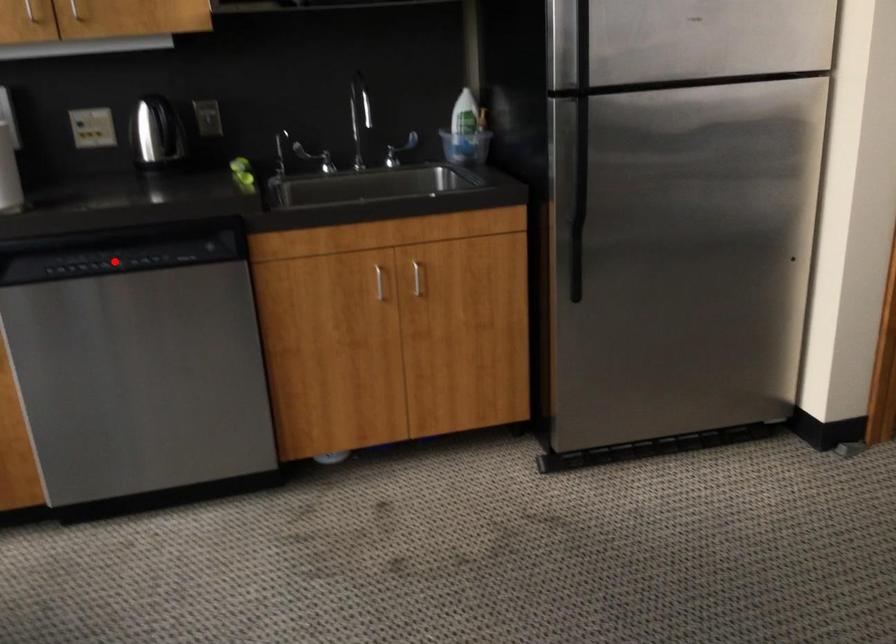
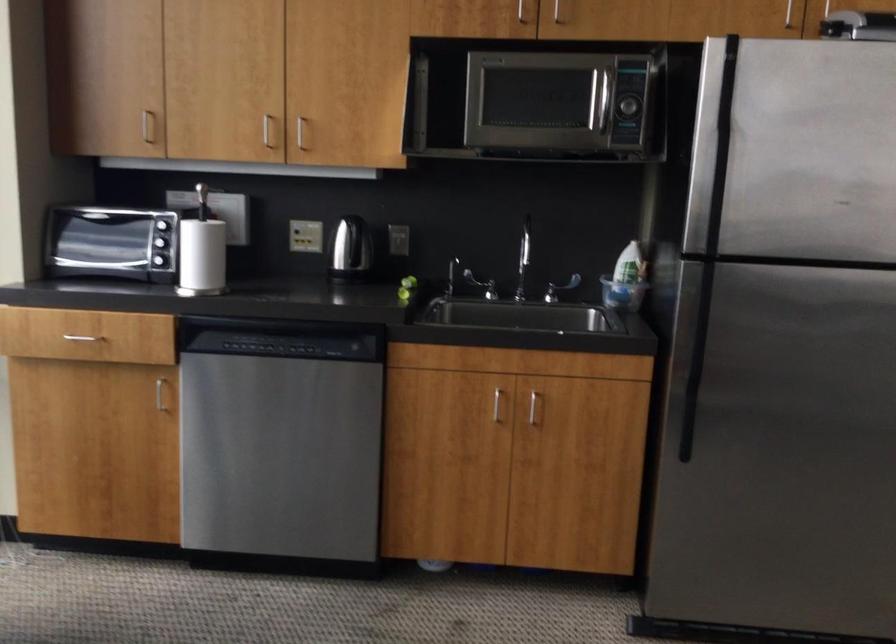
Find the pixel in the second image that matches the highlighted location in the first image.

(277, 346)